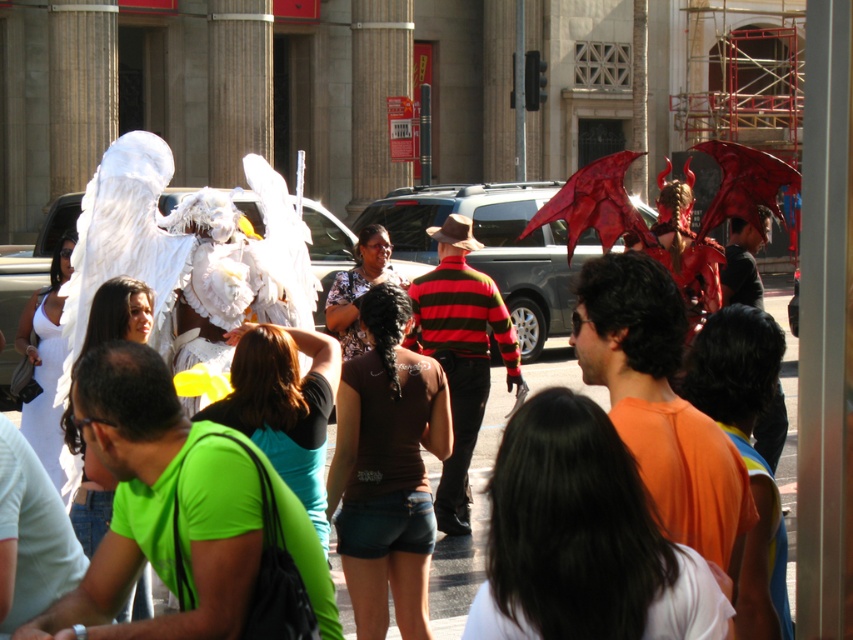
You are a photographer trying to capture a clear shot of both the white matte wings at upper left and the brown fabric shirt at center. Since you want to focus on the details of the wings, which object should you adjust your camera focus to prioritize, considering their sizes?

The white matte wings at upper left is thinner than the brown fabric shirt at center, so you should prioritize focusing on the white matte wings at upper left because smaller objects require more precise focus to capture details clearly.